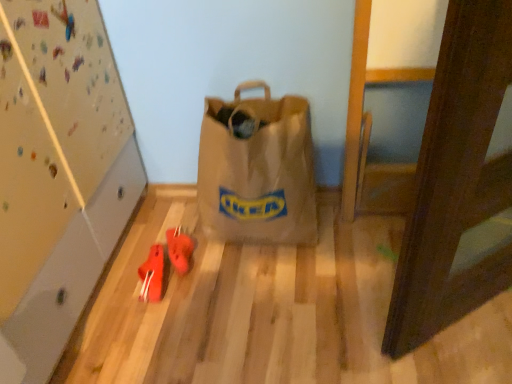
You are a GUI agent. You are given a task and a screenshot of the screen. Output one action in this format:
    pyautogui.click(x=<x>, y=<y>)
    Task: Click on the free space to the back side of rubberized red shoes at lower left, the first footwear when ordered from left to right
    This screenshot has width=512, height=384.
    Given the screenshot: What is the action you would take?
    pyautogui.click(x=152, y=241)